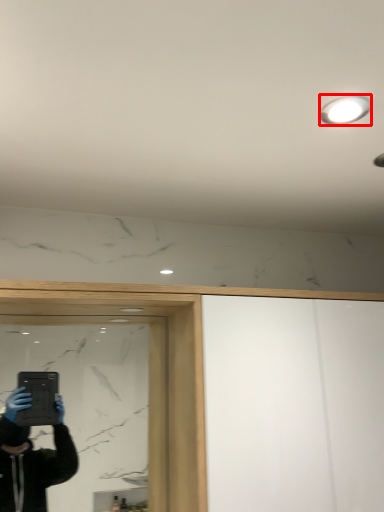
Question: In this image, where is light fixture (annotated by the red box) located relative to mirror?

Choices:
 (A) left
 (B) right

Answer: (B)